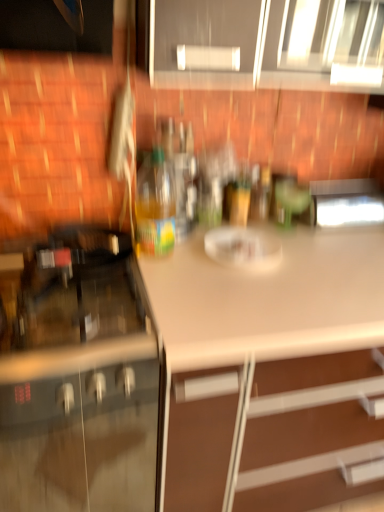
Question: Is matte gray cabinets at upper center, which appears as the 1th cabinetry when viewed from the right, closer to the viewer compared to matte black oven at left, the second cabinetry when ordered from top to bottom?

Choices:
 (A) yes
 (B) no

Answer: (B)

Question: Can you confirm if matte gray cabinets at upper center, positioned as the first cabinetry in top-to-bottom order, is positioned to the right of matte black oven at left, the second cabinetry when ordered from right to left?

Choices:
 (A) no
 (B) yes

Answer: (B)

Question: From a real-world perspective, is matte gray cabinets at upper center, which appears as the 1th cabinetry when viewed from the right, located higher than matte black oven at left, acting as the 1th cabinetry starting from the bottom?

Choices:
 (A) no
 (B) yes

Answer: (B)

Question: Is matte gray cabinets at upper center, arranged as the second cabinetry when viewed from the left, far from matte black oven at left, acting as the 1th cabinetry starting from the bottom?

Choices:
 (A) yes
 (B) no

Answer: (B)

Question: Is matte gray cabinets at upper center, positioned as the first cabinetry in top-to-bottom order, outside matte black oven at left, the second cabinetry when ordered from right to left?

Choices:
 (A) no
 (B) yes

Answer: (B)

Question: From a real-world perspective, is matte gray cabinets at upper center, which appears as the 1th cabinetry when viewed from the right, located beneath matte black oven at left, the first cabinetry in the left-to-right sequence?

Choices:
 (A) yes
 (B) no

Answer: (B)

Question: Is metallic stainless steel microwave at upper right shorter than matte gray cabinets at upper center, arranged as the second cabinetry when viewed from the left?

Choices:
 (A) yes
 (B) no

Answer: (A)

Question: Is metallic stainless steel microwave at upper right not within matte gray cabinets at upper center, marked as the 2th cabinetry in a bottom-to-top arrangement?

Choices:
 (A) yes
 (B) no

Answer: (A)

Question: Is metallic stainless steel microwave at upper right bigger than matte gray cabinets at upper center, marked as the 2th cabinetry in a bottom-to-top arrangement?

Choices:
 (A) yes
 (B) no

Answer: (B)

Question: From the image's perspective, does metallic stainless steel microwave at upper right appear higher than matte gray cabinets at upper center, arranged as the second cabinetry when viewed from the left?

Choices:
 (A) yes
 (B) no

Answer: (B)

Question: Is metallic stainless steel microwave at upper right to the left of matte gray cabinets at upper center, marked as the 2th cabinetry in a bottom-to-top arrangement, from the viewer's perspective?

Choices:
 (A) no
 (B) yes

Answer: (A)

Question: Is metallic stainless steel microwave at upper right turned away from matte gray cabinets at upper center, marked as the 2th cabinetry in a bottom-to-top arrangement?

Choices:
 (A) yes
 (B) no

Answer: (B)

Question: Is translucent plastic bottle at center wider than white matte countertop at center?

Choices:
 (A) yes
 (B) no

Answer: (B)